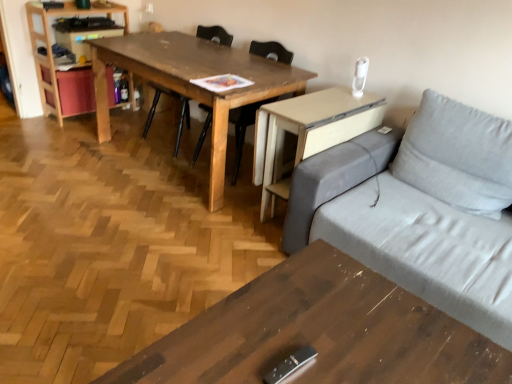
Identify the location of vacant area that is in front of light wood bookshelf at left. (58, 133).